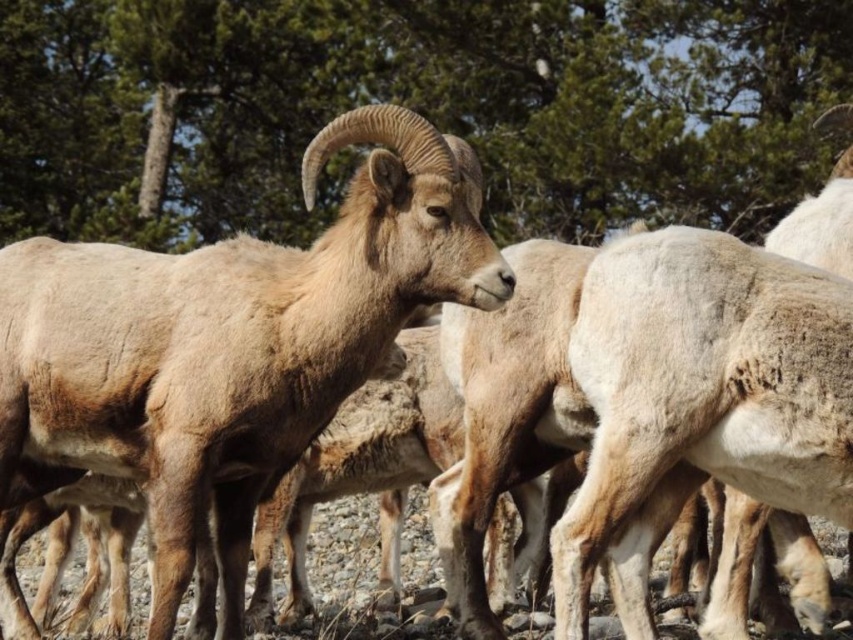
Does green leafy tree at upper center have a smaller size compared to brown woolen goat at center?

No, green leafy tree at upper center is not smaller than brown woolen goat at center.

Measure the distance between point (x=294, y=236) and camera.

A distance of 20.48 meters exists between point (x=294, y=236) and camera.

Does point (527, 90) lie behind point (117, 326)?

Yes, it is.

Locate an element on the screen. Image resolution: width=853 pixels, height=640 pixels. green leafy tree at upper center is located at coordinates tap(413, 109).